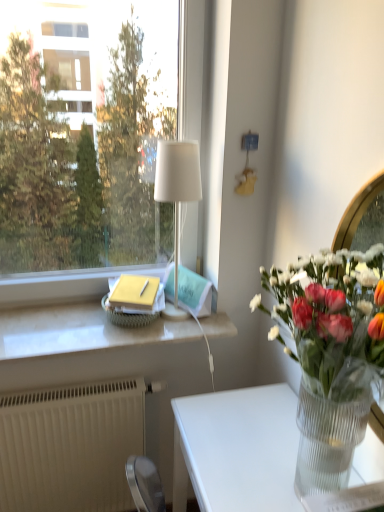
Question: Relative to transparent glass vase at lower right, is white marble window sill at center in front or behind?

Choices:
 (A) front
 (B) behind

Answer: (B)

Question: Is white marble window sill at center inside the boundaries of transparent glass vase at lower right, or outside?

Choices:
 (A) outside
 (B) inside

Answer: (A)

Question: Which object is positioned closest to the clear glass vase at right?

Choices:
 (A) white textured radiator at lower left
 (B) white marble window sill at center
 (C) transparent glass window at upper left
 (D) transparent glass vase at lower right
 (E) white fabric lampshade at upper center

Answer: (D)

Question: Which object is the farthest from the white marble window sill at center?

Choices:
 (A) transparent glass window at upper left
 (B) transparent glass vase at lower right
 (C) white textured radiator at lower left
 (D) clear glass vase at right
 (E) white fabric lampshade at upper center

Answer: (A)